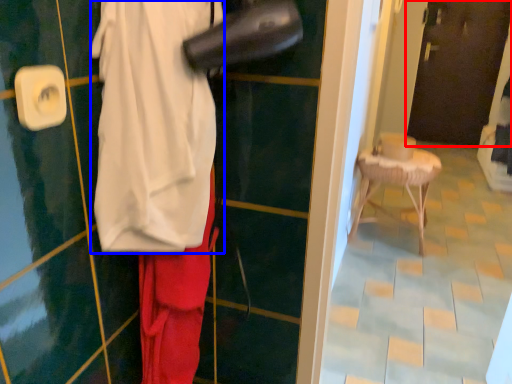
Question: Which object appears closest to the camera in this image, door (highlighted by a red box) or wide (highlighted by a blue box)?

Choices:
 (A) door
 (B) wide

Answer: (B)